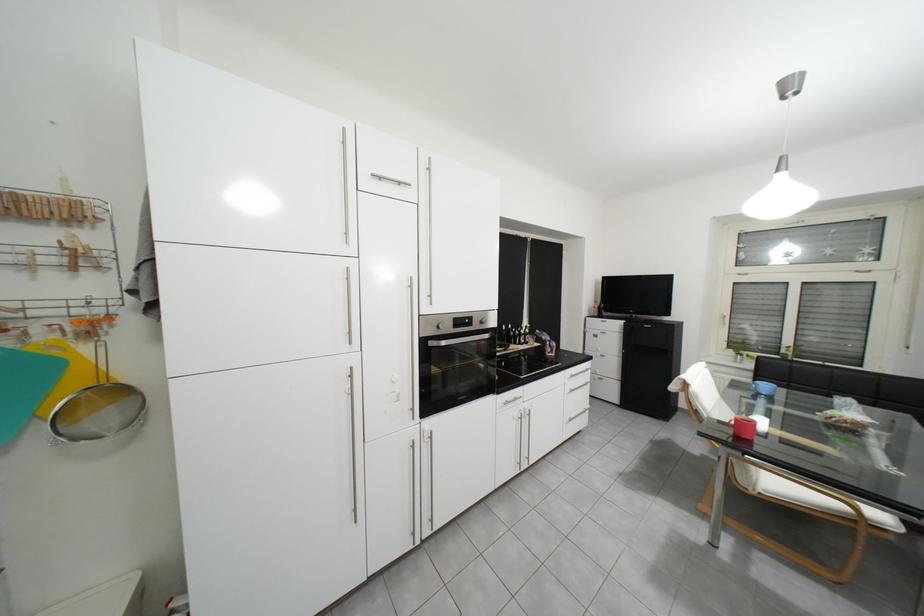
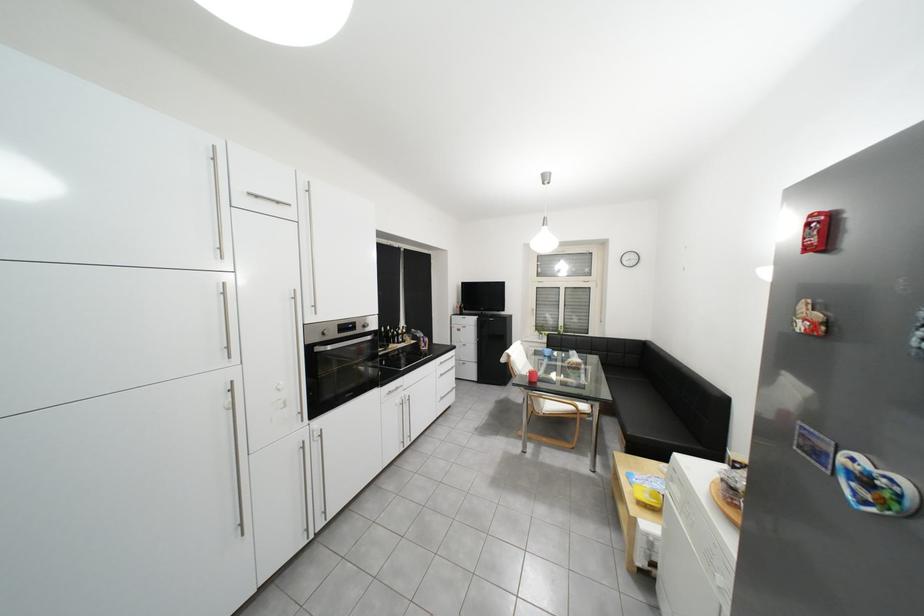
Locate, in the second image, the point that corresponds to the point at 788,485 in the first image.

(563, 407)